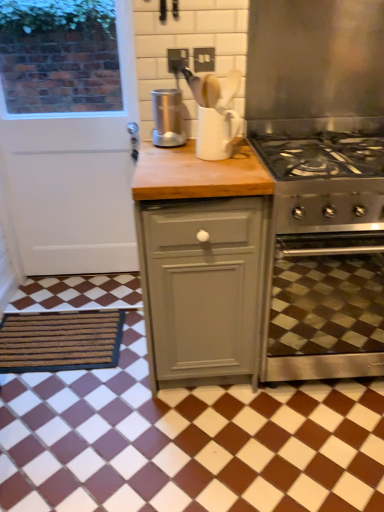
Find the location of `vacant space in front of brown textured mat at lower left`. vacant space in front of brown textured mat at lower left is located at coordinates (64, 422).